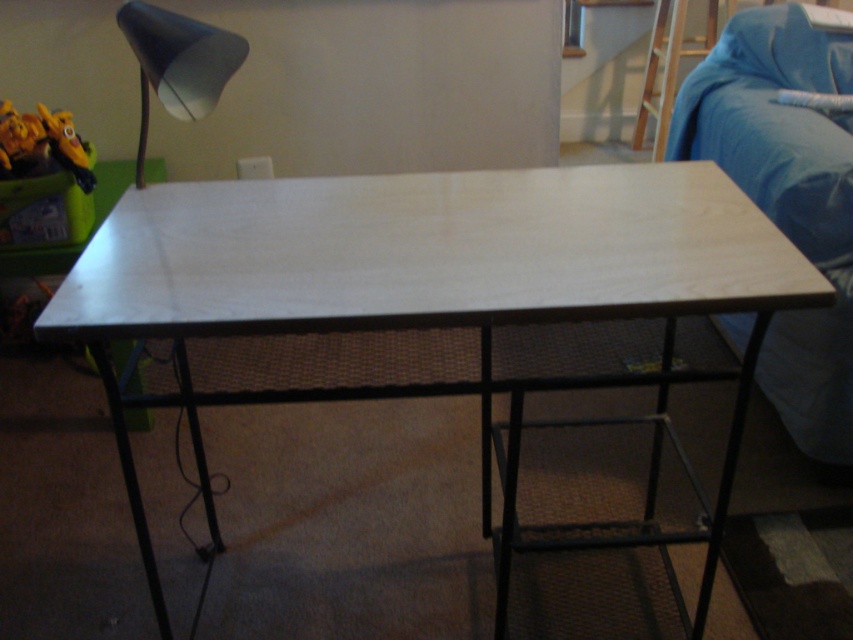
Measure the distance between point (x=128, y=234) and camera.

The distance of point (x=128, y=234) from camera is 4.43 feet.

Does bare wood table at center appear on the left side of matte black lampshade at upper left?

No, bare wood table at center is not to the left of matte black lampshade at upper left.

This screenshot has width=853, height=640. In order to click on bare wood table at center in this screenshot , I will do `click(416, 260)`.

Is blue fabric couch at right positioned before matte black lampshade at upper left?

That is False.

Is blue fabric couch at right shorter than matte black lampshade at upper left?

No, blue fabric couch at right is not shorter than matte black lampshade at upper left.

Who is more distant from viewer, (740, 339) or (170, 49)?

The point (740, 339) is behind.

At what (x,y) coordinates should I click in order to perform the action: click on blue fabric couch at right. Please return your answer as a coordinate pair (x, y). Looking at the image, I should click on (786, 196).

Does blue fabric couch at right appear on the left side of wooden stool at upper right?

Correct, you'll find blue fabric couch at right to the left of wooden stool at upper right.

Describe the element at coordinates (786, 196) in the screenshot. Image resolution: width=853 pixels, height=640 pixels. I see `blue fabric couch at right` at that location.

Where is `blue fabric couch at right`? blue fabric couch at right is located at coordinates (786, 196).